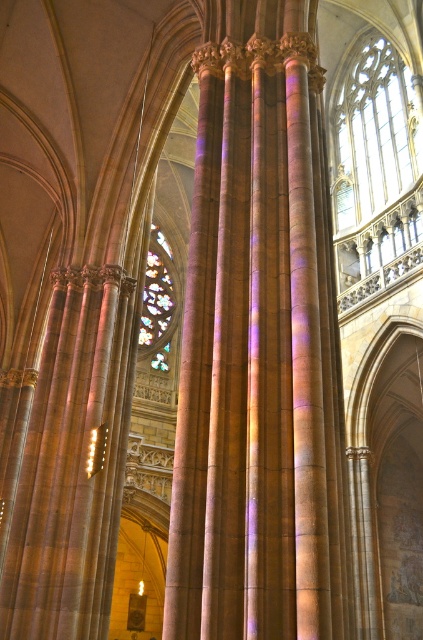
Question: Which object is farther from the camera taking this photo?

Choices:
 (A) clear glass window at upper right
 (B) stained glass window at center

Answer: (B)

Question: Is clear glass window at upper right to the left of stained glass window at center from the viewer's perspective?

Choices:
 (A) no
 (B) yes

Answer: (A)

Question: Is stained glass window at center wider than metallic gold light at center?

Choices:
 (A) no
 (B) yes

Answer: (B)

Question: Which object is the farthest from the metallic gold light at center?

Choices:
 (A) clear glass window at upper right
 (B) stained glass window at center

Answer: (A)

Question: Which point appears farthest from the camera in this image?

Choices:
 (A) (173, 305)
 (B) (104, 428)
 (C) (348, 104)

Answer: (A)

Question: Where is clear glass window at upper right located in relation to stained glass window at center in the image?

Choices:
 (A) left
 (B) right

Answer: (B)